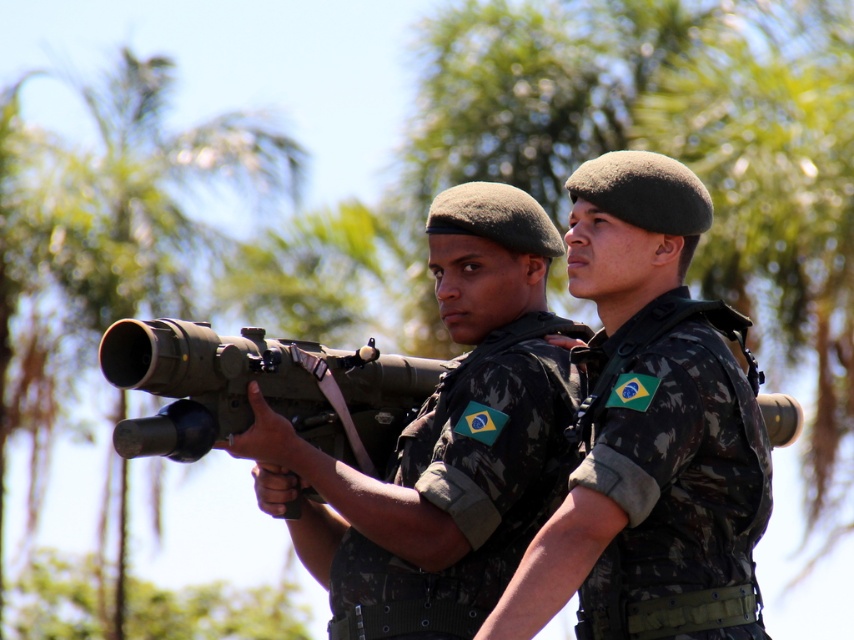
You are a drone operator trying to identify which of the two points in the image is closer to your camera. The points are labeled as point 1 at coordinates point (715, 368) and point 2 at coordinates point (301, 428). Based on the scene provided, which point is closer to the camera?

Point 1 at coordinates point (715, 368) is closer to the camera than point 2 at coordinates point (301, 428).

You are a military observer tasked with identifying the positions of the soldiers in the image. Which object is positioned behind the other between the camo uniform at center and the matte black rifle at center?

The matte black rifle at center is positioned behind the camo uniform at center.